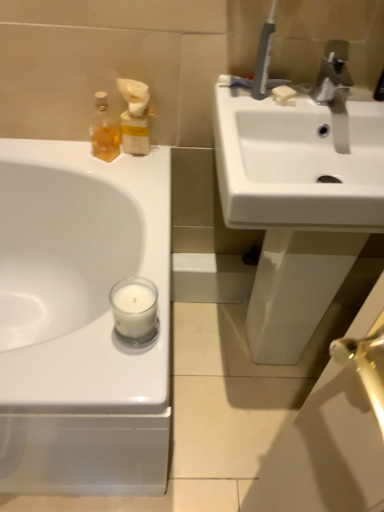
Describe the element at coordinates (134, 307) in the screenshot. Image resolution: width=384 pixels, height=512 pixels. I see `white matte glass candle at lower center` at that location.

In order to click on translucent glass bottle at upper left in this screenshot , I will do `click(104, 131)`.

The image size is (384, 512). What do you see at coordinates (81, 320) in the screenshot?
I see `white glossy sink at upper left, placed as the 2th sink when sorted from right to left` at bounding box center [81, 320].

Where is `white matte glass candle at lower center`? The width and height of the screenshot is (384, 512). white matte glass candle at lower center is located at coordinates (134, 307).

Is translucent glass bottle at upper left turned away from white glossy sink at upper right, the 1th sink when ordered from right to left?

translucent glass bottle at upper left does not have its back to white glossy sink at upper right, the 1th sink when ordered from right to left.

Between translucent glass bottle at upper left and white glossy sink at upper right, which is the second sink in left-to-right order, which one appears on the right side from the viewer's perspective?

white glossy sink at upper right, which is the second sink in left-to-right order.

What's the angular difference between translucent glass bottle at upper left and white glossy sink at upper right, the 1th sink when ordered from right to left,'s facing directions?

29.2 degrees separate the facing orientations of translucent glass bottle at upper left and white glossy sink at upper right, the 1th sink when ordered from right to left.

From the image's perspective, between translucent glass bottle at upper left and white glossy sink at upper right, which is the second sink in left-to-right order, who is located below?

white glossy sink at upper right, which is the second sink in left-to-right order, from the image's perspective.

At what (x,y) coordinates should I click in order to perform the action: click on soap above the white glossy sink at upper left, placed as the 2th sink when sorted from right to left (from a real-world perspective). Please return your answer as a coordinate pair (x, y). The width and height of the screenshot is (384, 512). Looking at the image, I should click on (283, 94).

From the image's perspective, which is above, white matte soap at upper right or white glossy sink at upper left, placed as the 2th sink when sorted from right to left?

white matte soap at upper right, from the image's perspective.

In terms of height, does white matte soap at upper right look taller or shorter compared to white glossy sink at upper left, placed as the 2th sink when sorted from right to left?

Clearly, white matte soap at upper right is shorter compared to white glossy sink at upper left, placed as the 2th sink when sorted from right to left.

Is white matte soap at upper right to the right of white glossy sink at upper left, placed as the 2th sink when sorted from right to left, from the viewer's perspective?

Correct, you'll find white matte soap at upper right to the right of white glossy sink at upper left, placed as the 2th sink when sorted from right to left.

From the image's perspective, is white glossy sink at upper right, which is the second sink in left-to-right order, positioned above or below white matte glass candle at lower center?

From the image's perspective, white glossy sink at upper right, which is the second sink in left-to-right order, appears above white matte glass candle at lower center.

Which of these two, white glossy sink at upper right, the 1th sink when ordered from right to left, or white matte glass candle at lower center, is smaller?

With smaller size is white matte glass candle at lower center.

Can you tell me how much white glossy sink at upper right, the 1th sink when ordered from right to left, and white matte glass candle at lower center differ in facing direction?

white glossy sink at upper right, the 1th sink when ordered from right to left, and white matte glass candle at lower center are facing 3.3 degrees away from each other.

Is white matte glass candle at lower center a part of white glossy sink at upper right, which is the second sink in left-to-right order?

No, white matte glass candle at lower center is not a part of white glossy sink at upper right, which is the second sink in left-to-right order.

Which object is thinner, white matte glass candle at lower center or white glossy sink at upper right, which is the second sink in left-to-right order?

white matte glass candle at lower center is thinner.

Is point (152, 325) behind point (318, 211)?

No, (152, 325) is closer to viewer.

From the image's perspective, is white matte glass candle at lower center on top of white glossy sink at upper right, the 1th sink when ordered from right to left?

No, from the image's perspective, white matte glass candle at lower center is not above white glossy sink at upper right, the 1th sink when ordered from right to left.

Is white matte glass candle at lower center in contact with white glossy sink at upper right, the 1th sink when ordered from right to left?

No.

Between point (323, 63) and point (131, 302), which one is positioned behind?

The point (323, 63) is farther from the camera.

From the image's perspective, which is above, silver metallic faucet at upper right or white matte glass candle at lower center?

silver metallic faucet at upper right is shown above in the image.

In terms of width, does silver metallic faucet at upper right look wider or thinner when compared to white matte glass candle at lower center?

Considering their sizes, silver metallic faucet at upper right looks broader than white matte glass candle at lower center.

From a real-world perspective, who is located lower, silver metallic faucet at upper right or white matte glass candle at lower center?

white matte glass candle at lower center is physically lower.

Is white matte glass candle at lower center aimed at translucent glass bottle at upper left?

No, white matte glass candle at lower center is not facing towards translucent glass bottle at upper left.

Based on the photo, is the position of white matte glass candle at lower center less distant than that of translucent glass bottle at upper left?

Yes, white matte glass candle at lower center is closer to the viewer.

From the image's perspective, which is above, white matte glass candle at lower center or translucent glass bottle at upper left?

translucent glass bottle at upper left is shown above in the image.

Between point (136, 287) and point (106, 118), which one is positioned in front?

The point (136, 287) is more forward.

How many degrees apart are the facing directions of silver metallic faucet at upper right and white glossy sink at upper right, which is the second sink in left-to-right order?

0.686 degrees.

From the image's perspective, between silver metallic faucet at upper right and white glossy sink at upper right, the 1th sink when ordered from right to left, who is located below?

white glossy sink at upper right, the 1th sink when ordered from right to left, appears lower in the image.

Between silver metallic faucet at upper right and white glossy sink at upper right, the 1th sink when ordered from right to left, which one is positioned behind?

silver metallic faucet at upper right is further from the camera.

Would you say silver metallic faucet at upper right contains white glossy sink at upper right, the 1th sink when ordered from right to left?

No, silver metallic faucet at upper right does not contain white glossy sink at upper right, the 1th sink when ordered from right to left.

From a real-world perspective, which sink is the 1st one underneath the translucent glass bottle at upper left? Please provide its 2D coordinates.

[(298, 203)]

You are a GUI agent. You are given a task and a screenshot of the screen. Output one action in this format:
    pyautogui.click(x=<x>, y=<y>)
    Task: Click on the soap behind the white glossy sink at upper left, the first sink from the left
    
    Given the screenshot: What is the action you would take?
    pyautogui.click(x=283, y=94)

From the image, which object appears to be nearer to white glossy sink at upper left, the first sink from the left, silver metallic faucet at upper right or white glossy sink at upper right, which is the second sink in left-to-right order?

Based on the image, white glossy sink at upper right, which is the second sink in left-to-right order, appears to be nearer to white glossy sink at upper left, the first sink from the left.

Based on the photo, looking at the image, which one is located closer to silver metallic faucet at upper right, translucent glass bottle at upper left or white glossy sink at upper right, the 1th sink when ordered from right to left?

white glossy sink at upper right, the 1th sink when ordered from right to left, is closer to silver metallic faucet at upper right.

Considering their positions, is white glossy sink at upper left, placed as the 2th sink when sorted from right to left, positioned further to white glossy sink at upper right, the 1th sink when ordered from right to left, than silver metallic faucet at upper right?

white glossy sink at upper left, placed as the 2th sink when sorted from right to left, lies further to white glossy sink at upper right, the 1th sink when ordered from right to left, than the other object.

Estimate the real-world distances between objects in this image. Which object is closer to white matte soap at upper right, translucent glass bottle at upper left or silver metallic faucet at upper right?

silver metallic faucet at upper right.

Considering their positions, is silver metallic faucet at upper right positioned closer to white matte glass candle at lower center than white glossy sink at upper right, which is the second sink in left-to-right order?

The object closer to white matte glass candle at lower center is white glossy sink at upper right, which is the second sink in left-to-right order.

Estimate the real-world distances between objects in this image. Which object is closer to silver metallic faucet at upper right, white matte soap at upper right or translucent glass bottle at upper left?

white matte soap at upper right lies closer to silver metallic faucet at upper right than the other object.

From the image, which object appears to be farther from white matte glass candle at lower center, translucent glass bottle at upper left or white glossy sink at upper left, placed as the 2th sink when sorted from right to left?

Based on the image, translucent glass bottle at upper left appears to be further to white matte glass candle at lower center.

Looking at the image, which one is located closer to translucent glass bottle at upper left, white glossy sink at upper right, which is the second sink in left-to-right order, or white matte soap at upper right?

Among the two, white matte soap at upper right is located nearer to translucent glass bottle at upper left.

At what (x,y) coordinates should I click in order to perform the action: click on candle located between white glossy sink at upper left, placed as the 2th sink when sorted from right to left, and white glossy sink at upper right, the 1th sink when ordered from right to left, in the left-right direction. Please return your answer as a coordinate pair (x, y). Looking at the image, I should click on (134, 307).

Locate an element on the screen. This screenshot has width=384, height=512. soap dispenser located between white glossy sink at upper left, placed as the 2th sink when sorted from right to left, and silver metallic faucet at upper right in the left-right direction is located at coordinates (104, 131).

Locate an element on the screen. Image resolution: width=384 pixels, height=512 pixels. soap between white glossy sink at upper left, placed as the 2th sink when sorted from right to left, and silver metallic faucet at upper right, in the horizontal direction is located at coordinates (283, 94).

Find the location of a particular element. soap between translucent glass bottle at upper left and silver metallic faucet at upper right is located at coordinates (283, 94).